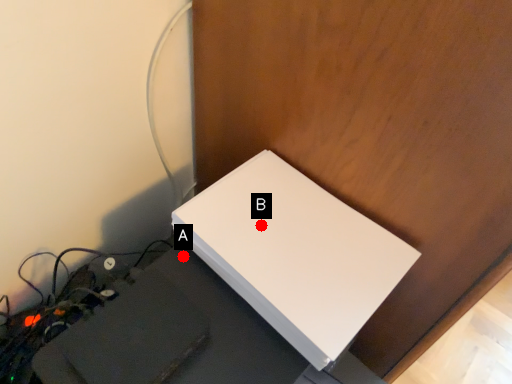
Question: Two points are circled on the image, labeled by A and B beside each circle. Which point is farther from the camera taking this photo?

Choices:
 (A) A is further
 (B) B is further

Answer: (A)